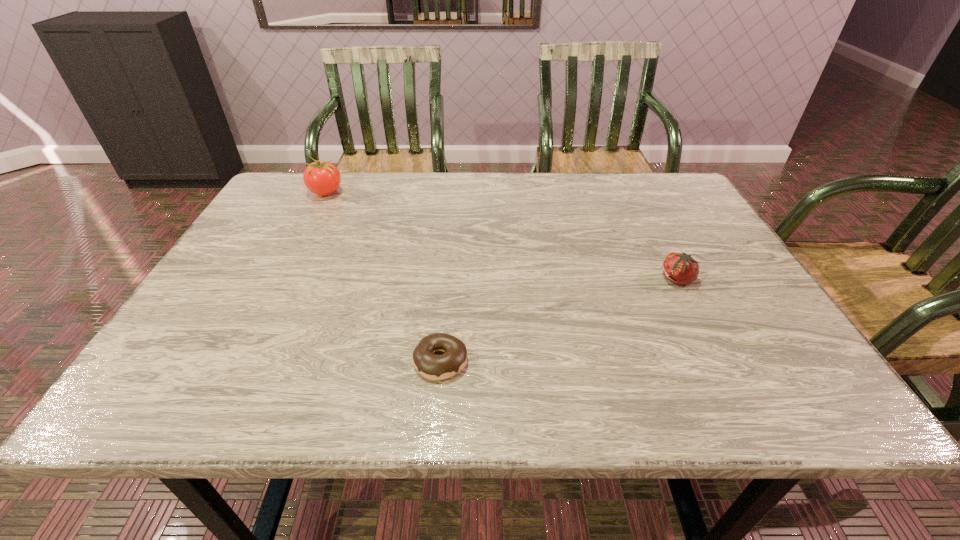
The height and width of the screenshot is (540, 960). What are the coordinates of `empty space between the nearest object and the farther tomato` in the screenshot? It's located at (383, 276).

The height and width of the screenshot is (540, 960). Find the location of `free space between the rightmost object and the second object from left to right`. free space between the rightmost object and the second object from left to right is located at coordinates (559, 320).

Identify the location of free space between the tallest object and the second object from right to left. This screenshot has height=540, width=960. (383, 276).

Where is `free space between the shortest object and the tallest object`? The height and width of the screenshot is (540, 960). free space between the shortest object and the tallest object is located at coordinates (383, 276).

Where is `empty space between the nearer tomato and the second object from left to right`? The width and height of the screenshot is (960, 540). empty space between the nearer tomato and the second object from left to right is located at coordinates (559, 320).

I want to click on unoccupied position between the left tomato and the nearest object, so click(x=383, y=276).

Identify the location of free space between the doughnut and the second farthest object. (559, 320).

Find the location of a particular element. The image size is (960, 540). empty space between the right tomato and the leftmost object is located at coordinates (501, 235).

The height and width of the screenshot is (540, 960). Identify the location of unoccupied area between the nearer tomato and the taller tomato. (501, 235).

This screenshot has width=960, height=540. Find the location of `free spot between the shorter tomato and the nearest object`. free spot between the shorter tomato and the nearest object is located at coordinates (559, 320).